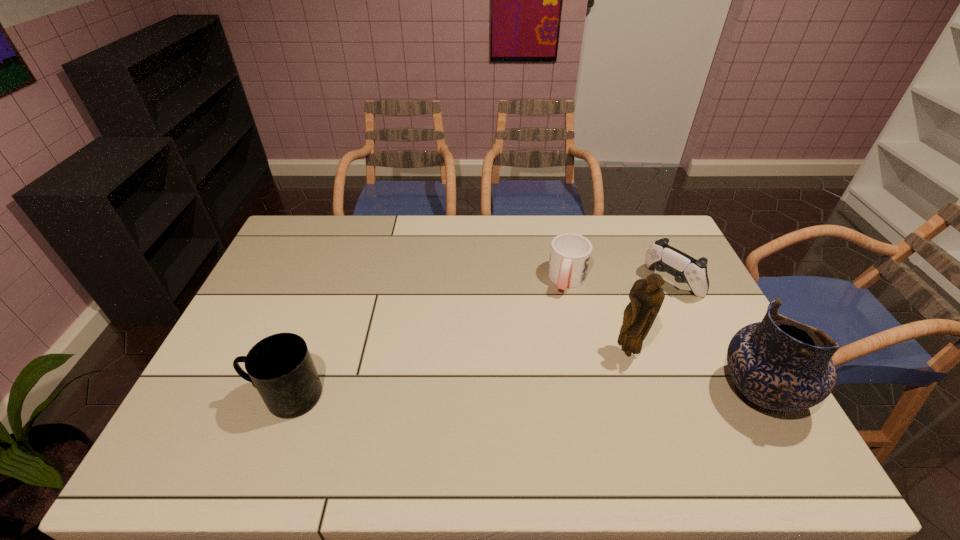
You are a GUI agent. You are given a task and a screenshot of the screen. Output one action in this format:
    pyautogui.click(x=<x>, y=<y>)
    Task: Click on the free space on the desktop that is between the leftmost object and the pottery and is positioned on the front-facing side of the figurine
    
    Given the screenshot: What is the action you would take?
    pyautogui.click(x=582, y=395)

At what (x,y) coordinates should I click in order to perform the action: click on vacant space on the desktop that is between the nearer mug and the pottery and is positioned on the front-facing side of the control. Please return your answer as a coordinate pair (x, y). This screenshot has height=540, width=960. Looking at the image, I should click on (534, 395).

Locate an element on the screen. vacant space on the desktop that is between the nearer mug and the pottery and is positioned on the side of the farther mug with the handle is located at coordinates (533, 395).